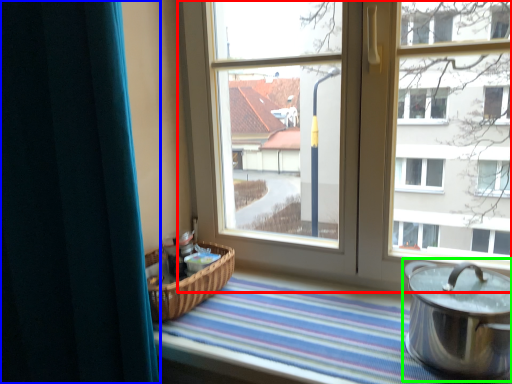
Question: Considering the real-world distances, which object is closest to window (highlighted by a red box)? curtain (highlighted by a blue box) or crock pot (highlighted by a green box).

Choices:
 (A) curtain
 (B) crock pot

Answer: (B)